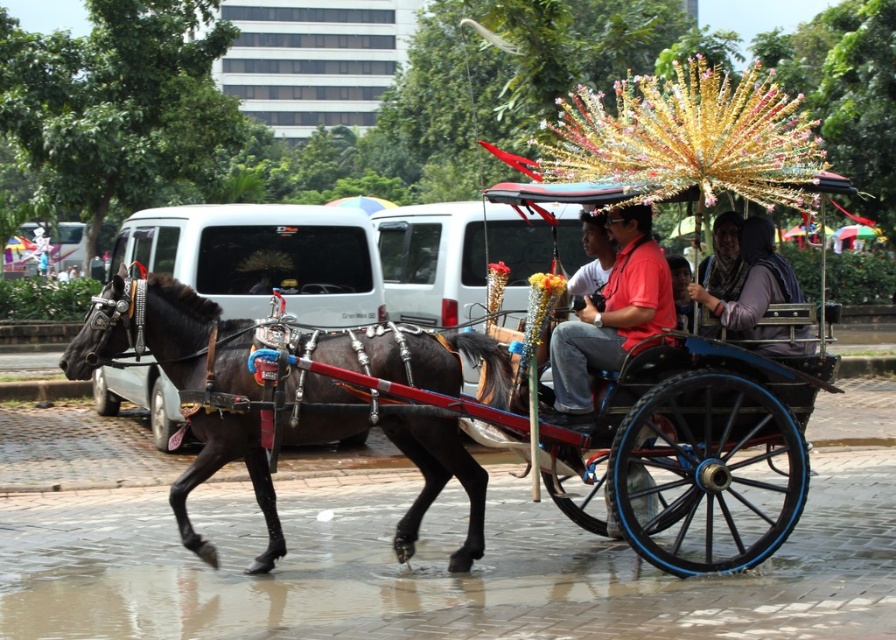
Is matte red shirt at center smaller than matte purple scarf at center?

Yes.

This screenshot has width=896, height=640. I want to click on matte red shirt at center, so click(x=613, y=312).

Who is more distant from viewer, [635,312] or [741,336]?

Positioned behind is point [741,336].

You are a GUI agent. You are given a task and a screenshot of the screen. Output one action in this format:
    pyautogui.click(x=<x>, y=<y>)
    Task: Click on the matte red shirt at center
    The height and width of the screenshot is (640, 896).
    Given the screenshot: What is the action you would take?
    pyautogui.click(x=613, y=312)

Does shiny black horse at left have a lesser height compared to matte purple scarf at center?

Incorrect, shiny black horse at left's height does not fall short of matte purple scarf at center's.

The width and height of the screenshot is (896, 640). I want to click on shiny black horse at left, so click(x=195, y=339).

Is shiny black horse at left positioned at the back of matte red shirt at center?

No.

Who is taller, shiny black horse at left or matte red shirt at center?

Standing taller between the two is shiny black horse at left.

This screenshot has height=640, width=896. I want to click on shiny black horse at left, so click(x=195, y=339).

The width and height of the screenshot is (896, 640). Find the location of `shiny black horse at left`. shiny black horse at left is located at coordinates (195, 339).